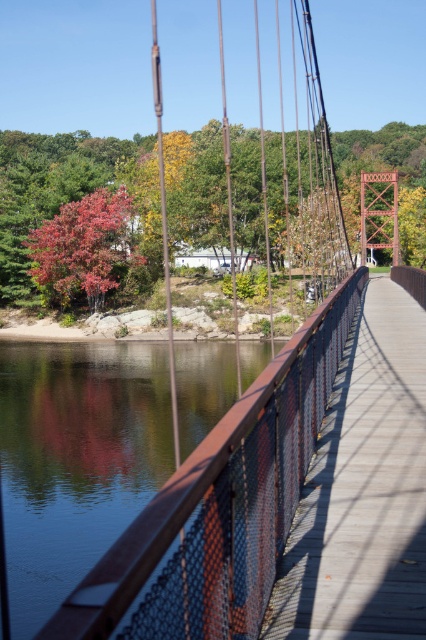
You are standing on the wooden bridge at center and want to take a photo of the glossy water at center. Which object should you point your camera towards to capture the taller one?

The glossy water at center is taller than the wooden bridge at center, so you should point your camera towards the glossy water at center to capture the taller one.